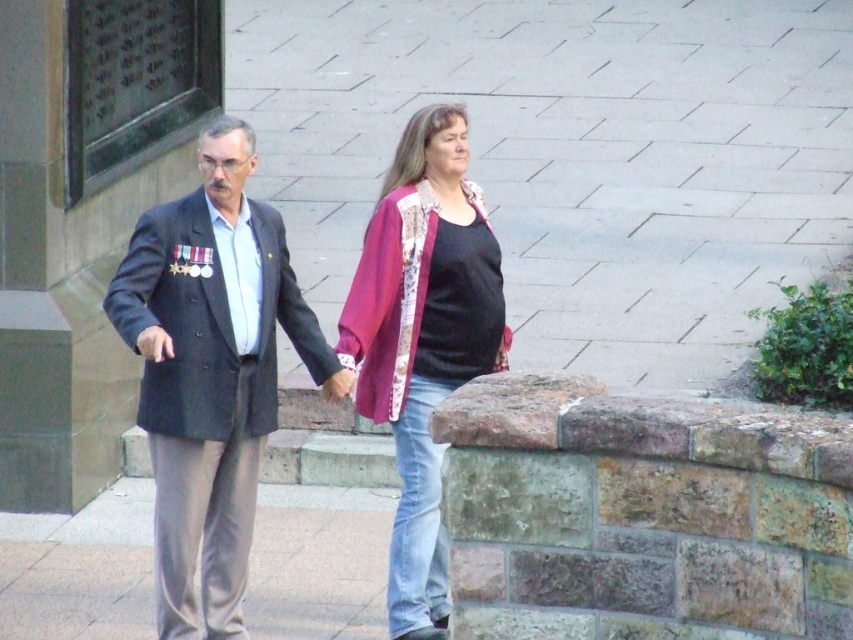
Question: Is dark gray suit at center positioned in front of rustic patchwork cardigan at center?

Choices:
 (A) yes
 (B) no

Answer: (A)

Question: Among these objects, which one is nearest to the camera?

Choices:
 (A) rustic patchwork cardigan at center
 (B) dark gray suit at center

Answer: (B)

Question: Can you confirm if dark gray suit at center is wider than rustic patchwork cardigan at center?

Choices:
 (A) no
 (B) yes

Answer: (B)

Question: Which point is closer to the camera?

Choices:
 (A) dark gray suit at center
 (B) rustic patchwork cardigan at center

Answer: (A)

Question: Which point is farther from the camera taking this photo?

Choices:
 (A) (161, 465)
 (B) (473, 252)

Answer: (B)

Question: Is dark gray suit at center below rustic patchwork cardigan at center?

Choices:
 (A) yes
 (B) no

Answer: (A)